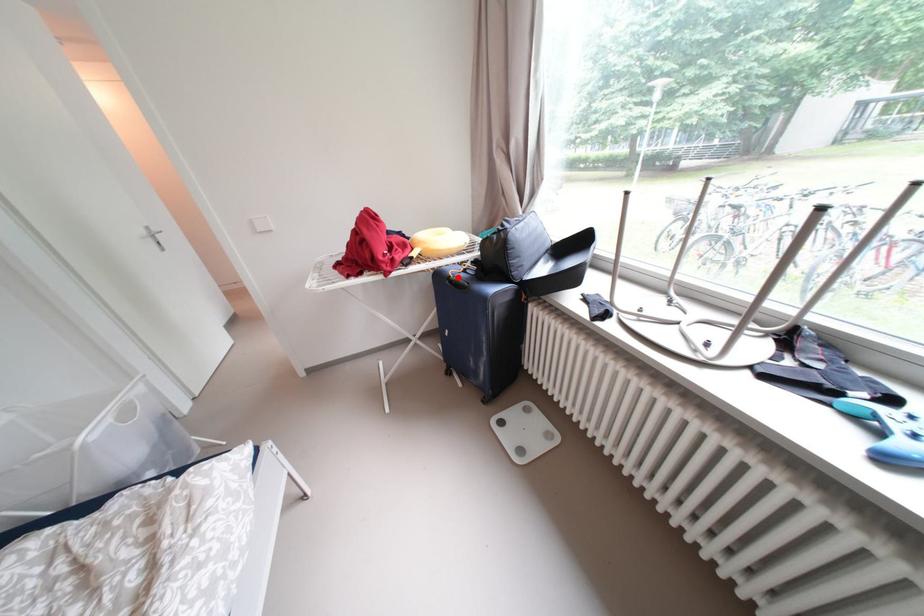
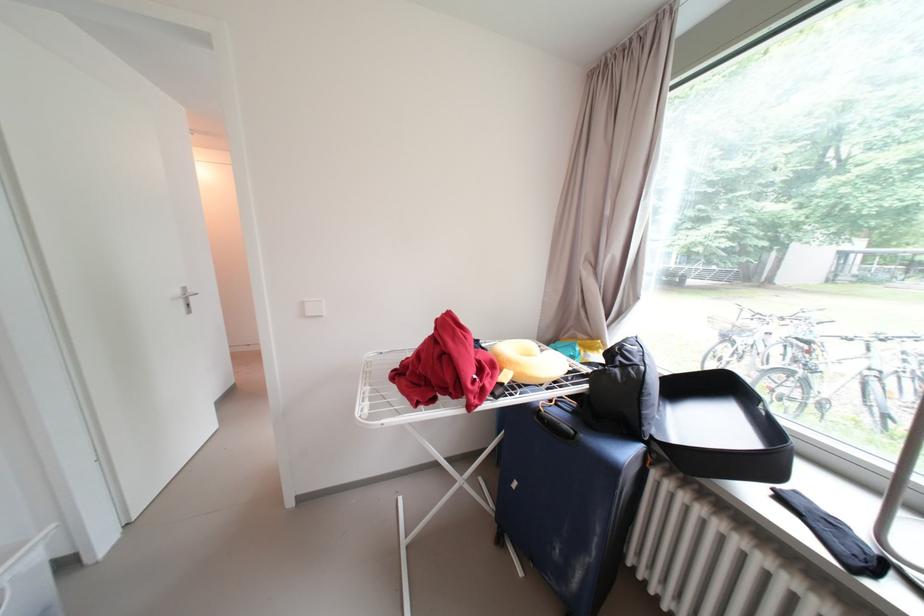
Where in the second image is the point corresponding to the highlighted location from the first image?

(549, 411)